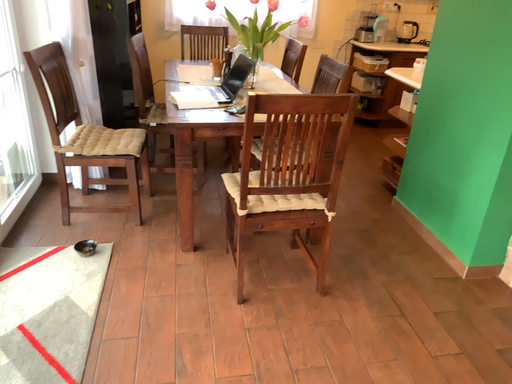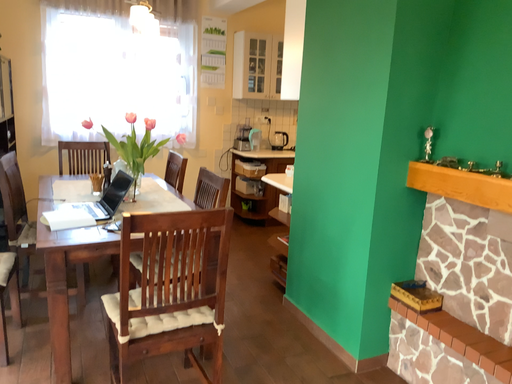
Question: Which way did the camera rotate in the video?

Choices:
 (A) rotated left
 (B) rotated right

Answer: (B)